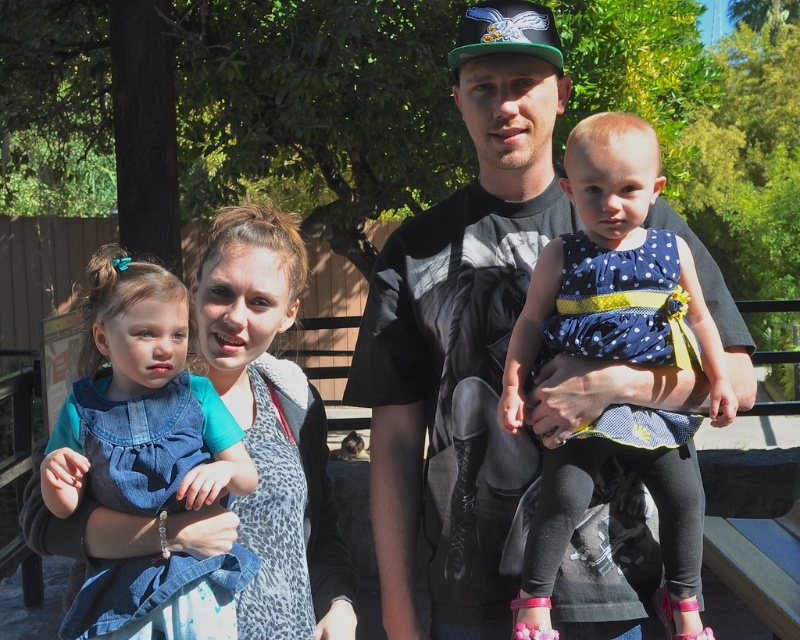
From the picture: You are a photographer trying to capture a closeup shot of the leopard print scarf at center. Given that the denim dress at left is blocking your view, can you determine if you need to move forward or backward to get a clear shot?

The denim dress at left is closer to the viewer than the leopard print scarf at center. To get a clear shot of the leopard print scarf at center without obstruction, you need to move forward so that the denim dress at left moves out of the way.